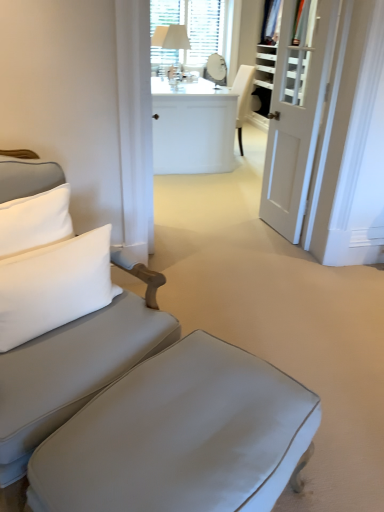
The width and height of the screenshot is (384, 512). I want to click on white textured mirror at upper center, so click(x=194, y=29).

Measure the distance between matte gray ottoman at lower center and camera.

They are 36.24 inches apart.

At what (x,y) coordinates should I click in order to perform the action: click on white soft pillow at left. Please return your answer as a coordinate pair (x, y). This screenshot has width=384, height=512. Looking at the image, I should click on (54, 286).

Measure the distance between matte gray fabric couch at left and camera.

The distance of matte gray fabric couch at left from camera is 3.48 feet.

What do you see at coordinates (296, 111) in the screenshot?
I see `white glossy door at right` at bounding box center [296, 111].

The image size is (384, 512). What are the coordinates of `white textured mirror at upper center` in the screenshot? It's located at (194, 29).

Do you think matte gray fabric couch at left is within white glossy desk at center, or outside of it?

The correct answer is: outside.

Does matte gray fabric couch at left come behind white glossy desk at center?

No, it is in front of white glossy desk at center.

Consider the image. From a real-world perspective, relative to white glossy desk at center, is matte gray fabric couch at left vertically above or below?

From a real-world perspective, matte gray fabric couch at left is physically above white glossy desk at center.

Which is more to the right, matte gray fabric couch at left or white glossy desk at center?

Positioned to the right is white glossy desk at center.

Is matte gray fabric couch at left closer to the viewer compared to white soft pillow at left?

Yes.

From the image's perspective, is matte gray fabric couch at left under white soft pillow at left?

Indeed, from the image's perspective, matte gray fabric couch at left is shown beneath white soft pillow at left.

Based on the photo, is matte gray fabric couch at left facing towards white soft pillow at left?

Yes.

Is matte gray fabric couch at left at the right side of white soft pillow at left?

Incorrect, matte gray fabric couch at left is not on the right side of white soft pillow at left.

Is white soft pillow at left bigger than white textured mirror at upper center?

No, white soft pillow at left is not bigger than white textured mirror at upper center.

Consider the image. Would you say white soft pillow at left is inside or outside white textured mirror at upper center?

white soft pillow at left exists outside the volume of white textured mirror at upper center.

From the image's perspective, is white soft pillow at left below white textured mirror at upper center?

Correct, white soft pillow at left appears lower than white textured mirror at upper center in the image.

Measure the distance from white glossy desk at center to white soft pillow at left.

white glossy desk at center is 10.23 feet away from white soft pillow at left.

Between white glossy desk at center and white soft pillow at left, which one has less height?

Standing shorter between the two is white soft pillow at left.

Is white glossy desk at center at the left side of white soft pillow at left?

Incorrect, white glossy desk at center is not on the left side of white soft pillow at left.

Between point (210, 82) and point (3, 335), which one is positioned behind?

Positioned behind is point (210, 82).

Does white textured mirror at upper center turn towards white fabric table lamp at upper center?

Yes, white textured mirror at upper center is aimed at white fabric table lamp at upper center.

Is point (223, 11) farther from viewer compared to point (184, 27)?

Yes, it is behind point (184, 27).

Considering the relative sizes of white textured mirror at upper center and white fabric table lamp at upper center in the image provided, is white textured mirror at upper center bigger than white fabric table lamp at upper center?

Correct, white textured mirror at upper center is larger in size than white fabric table lamp at upper center.

How far apart are white textured mirror at upper center and white fabric table lamp at upper center?

white textured mirror at upper center and white fabric table lamp at upper center are 19.85 inches apart.

From the image's perspective, is white fabric table lamp at upper center above white glossy desk at center?

Yes, from the image's perspective, white fabric table lamp at upper center is on top of white glossy desk at center.

In the scene shown: From a real-world perspective, who is located higher, white fabric table lamp at upper center or white glossy desk at center?

white fabric table lamp at upper center.

I want to click on table lamp to the left of white glossy desk at center, so click(x=176, y=38).

Is point (167, 46) behind point (197, 89)?

No, it is in front of (197, 89).

From a real-world perspective, which is physically below, white glossy desk at center or matte gray fabric couch at left?

white glossy desk at center.

Based on the photo, is white glossy desk at center at the right side of matte gray fabric couch at left?

Yes, white glossy desk at center is to the right of matte gray fabric couch at left.

In terms of width, does white glossy desk at center look wider or thinner when compared to matte gray fabric couch at left?

white glossy desk at center is wider than matte gray fabric couch at left.

Is white glossy desk at center inside or outside of matte gray fabric couch at left?

white glossy desk at center is spatially situated outside matte gray fabric couch at left.

Where is `studio couch that is in front of the white glossy desk at center`? This screenshot has width=384, height=512. studio couch that is in front of the white glossy desk at center is located at coordinates (71, 372).

At what (x,y) coordinates should I click in order to perform the action: click on pillow above the matte gray fabric couch at left (from the image's perspective). Please return your answer as a coordinate pair (x, y). The height and width of the screenshot is (512, 384). Looking at the image, I should click on (54, 286).

Looking at the image, which one is located closer to white glossy desk at center, matte gray ottoman at lower center or white fabric table lamp at upper center?

white fabric table lamp at upper center lies closer to white glossy desk at center than the other object.

From the image, which object appears to be nearer to white soft pillow at left, matte gray ottoman at lower center or white glossy door at right?

Based on the image, matte gray ottoman at lower center appears to be nearer to white soft pillow at left.

Based on their spatial positions, is white soft pillow at left or matte gray fabric couch at left closer to white fabric table lamp at upper center?

Based on the image, white soft pillow at left appears to be nearer to white fabric table lamp at upper center.

Based on their spatial positions, is white soft pillow at left or white glossy desk at center further from white glossy door at right?

Based on the image, white soft pillow at left appears to be further to white glossy door at right.

Considering their positions, is white soft pillow at left positioned closer to white glossy desk at center than white fabric table lamp at upper center?

white fabric table lamp at upper center.

When comparing their distances from matte gray ottoman at lower center, does white textured mirror at upper center or white glossy desk at center seem further?

Based on the image, white textured mirror at upper center appears to be further to matte gray ottoman at lower center.

Which object lies further to the anchor point matte gray ottoman at lower center, white glossy desk at center or white soft pillow at left?

white glossy desk at center lies further to matte gray ottoman at lower center than the other object.

Which object lies further to the anchor point white soft pillow at left, white glossy door at right or white fabric table lamp at upper center?

white fabric table lamp at upper center.

At what (x,y) coordinates should I click in order to perform the action: click on table lamp between white glossy door at right and white textured mirror at upper center along the z-axis. Please return your answer as a coordinate pair (x, y). This screenshot has height=512, width=384. Looking at the image, I should click on (176, 38).

This screenshot has width=384, height=512. I want to click on door between white soft pillow at left and white glossy desk at center in the front-back direction, so click(296, 111).

This screenshot has height=512, width=384. I want to click on door located between matte gray fabric couch at left and white textured mirror at upper center in the depth direction, so click(x=296, y=111).

Find the location of a particular element. door positioned between matte gray ottoman at lower center and white glossy desk at center from near to far is located at coordinates (296, 111).